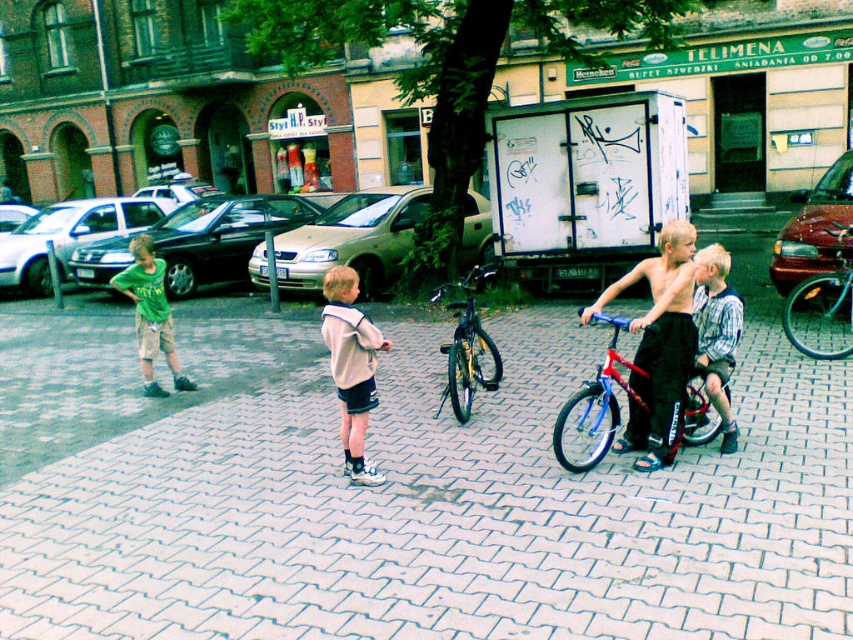
You are a photographer trying to capture a photo of the blue metallic bicycle at center without including the shiny black shorts at center in the frame. Based on their positions, is this possible?

The shiny black shorts at center is positioned on the left side of blue metallic bicycle at center, so if you position yourself to the right side of the bicycle, you can exclude the shorts from the frame.

You are a photographer standing in the town square and want to take a photo of the two points mentioned. Which point is closer to your camera, point [691,275] or point [790,317]?

Point [691,275] is closer to the camera than point [790,317].